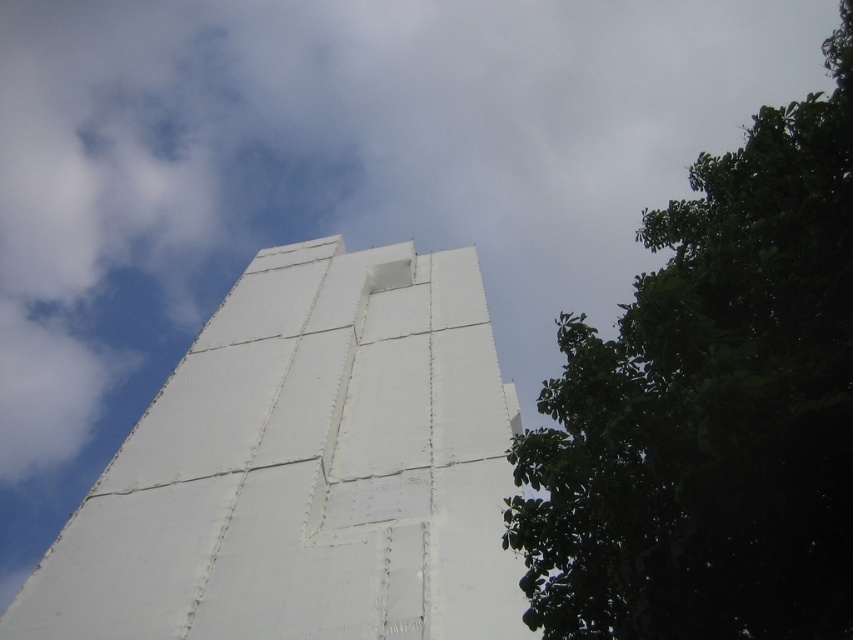
Based on the photo, you are a drone operator tasked with flying a drone between the white matte tower at center and the green leafy tree at lower right. The drone has a maximum flight distance of 20 meters. Based on the scene, can the drone safely fly from one to the other without exceeding its range?

The white matte tower at center and the green leafy tree at lower right are 21.59 meters apart from each other. Since the drone can only fly up to 20 meters, it cannot safely make the trip between them without exceeding its range.

You are standing in front of the white matte tower at center and want to take a photo of the green leafy tree at lower right. Which direction should you face to ensure the tree is in the frame?

Since the white matte tower at center is located below the green leafy tree at lower right, you should face upward to include the tree in your photo.